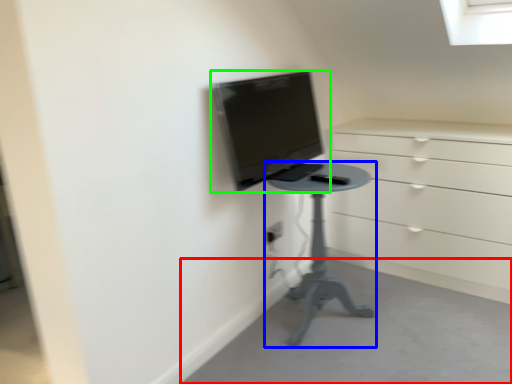
Question: Which is farther away from concrete (highlighted by a red box)? furniture (highlighted by a blue box) or computer monitor (highlighted by a green box)?

Choices:
 (A) furniture
 (B) computer monitor

Answer: (B)